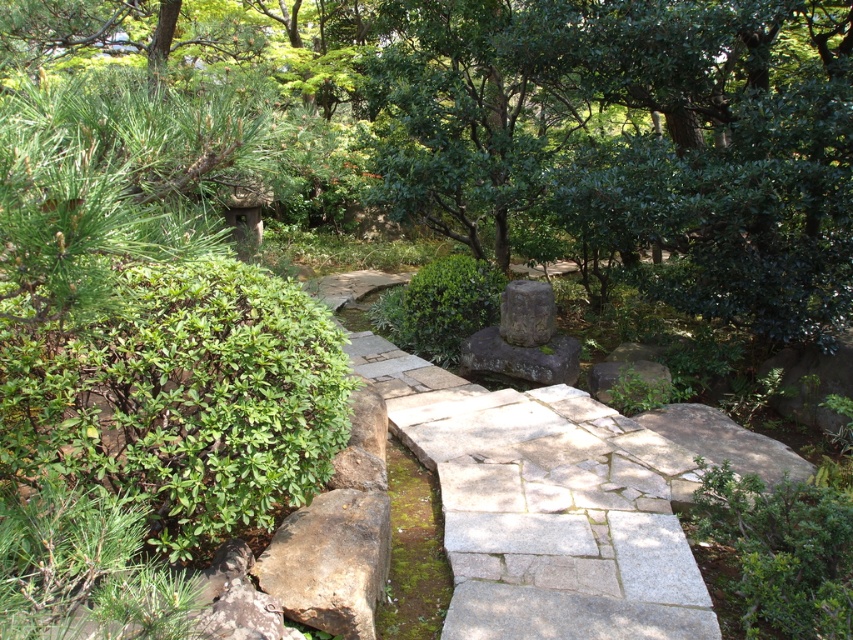
You are a gardener planning to place a new decorative rock next to the green leafy bush at left and the gray stone at center. Considering their sizes, which object should you place the rock closer to to ensure it doesn not look too small in comparison?

The green leafy bush at left is larger in size than the gray stone at center, so placing the decorative rock closer to the gray stone at center would prevent it from appearing too small in comparison.

You are standing at the entrance of the Japanese garden and notice the green leafy bush at left. If you want to reach the bush, which direction should you move relative to the winding stone pathway that leads through the garden?

The green leafy bush at left is located at point coordinates, so you should move towards the left side of the winding stone pathway to reach it.

You are a visitor in the Japanese garden and want to take a photo of both the green leafy bush at lower right and the green leafy bush at center. Which bush should you stand closer to in order to capture both in a single frame?

You should stand closer to the green leafy bush at lower right because it is smaller than the green leafy bush at center. By positioning yourself nearer to the smaller bush, you can include both bushes within the camera frame more effectively.